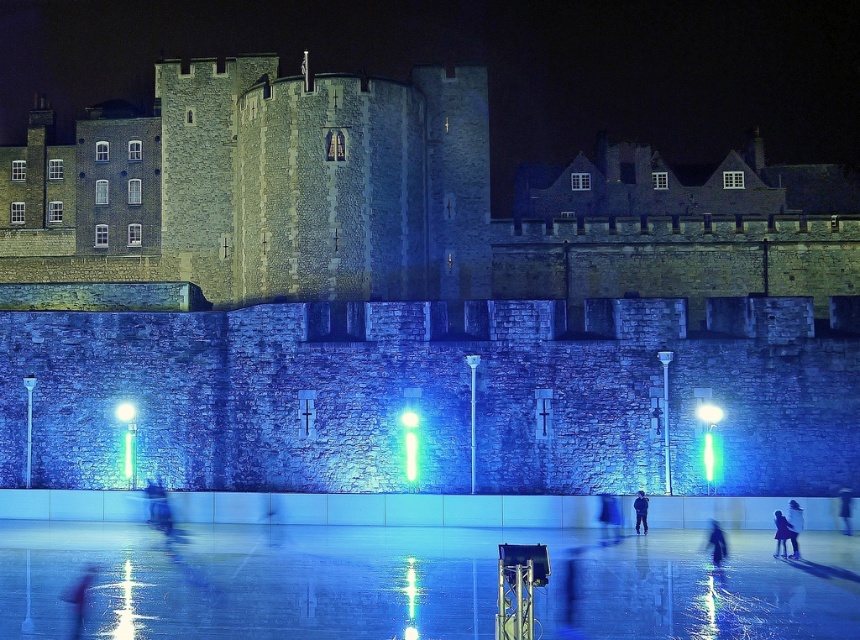
Can you confirm if stone wall at center is positioned to the left of dark blue jeans at center?

Indeed, stone wall at center is positioned on the left side of dark blue jeans at center.

Does point (396, 202) come behind point (645, 532)?

Yes, it is.

Between point (570, 284) and point (646, 529), which one is positioned in front?

Point (646, 529) is in front.

What are the coordinates of `stone wall at center` in the screenshot? It's located at (387, 200).

Is glossy ice rink at lower center positioned in front of dark blue fabric jacket at lower right?

Yes.

Locate an element on the screen. Image resolution: width=860 pixels, height=640 pixels. glossy ice rink at lower center is located at coordinates (415, 582).

Identify the location of glossy ice rink at lower center. This screenshot has width=860, height=640. (415, 582).

Is point (796, 528) farther from viewer compared to point (783, 529)?

Yes, it is behind point (783, 529).

Can you confirm if dark blue fabric jacket at lower right is positioned below dark blue fabric coat at lower right?

Incorrect, dark blue fabric jacket at lower right is not positioned below dark blue fabric coat at lower right.

At what (x,y) coordinates should I click in order to perform the action: click on dark blue fabric jacket at lower right. Please return your answer as a coordinate pair (x, y). Looking at the image, I should click on (794, 525).

The width and height of the screenshot is (860, 640). I want to click on dark blue fabric jacket at lower right, so click(x=794, y=525).